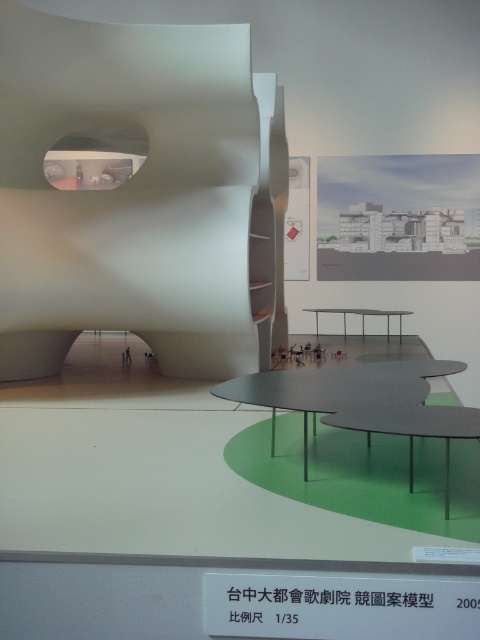
You are setting up a presentation and need to place a 10 cm wide model on a table. You have two tables available in the scene. Which table, the matte gray table at lower center or the metallic gray table at center, is more suitable for placing the model?

The metallic gray table at center is more suitable because it is wider than the matte gray table at lower center, providing enough space for the 10 cm wide model.

You are a visitor at the exhibition and need to place a small model airplane on the table closest to the entrance. The entrance is at the bottom of the image. Which table between the matte gray table at lower center and the metallic gray table at center should you choose?

The matte gray table at lower center is closer to the entrance since it is located at the lower part of the image, so you should place the model airplane there.

You are an architect holding a 10 cm scale model of a new building design. You want to place it on the nearest table between the matte gray table at center and the matte gray table at lower center. Which table should you choose?

The matte gray table at lower center is closer to the matte gray table at center by 15.49 centimeters. Since the scale model is only 10 cm wide, it will fit on either table. However, to place it on the nearest table, you should choose the matte gray table at lower center because it is closer.